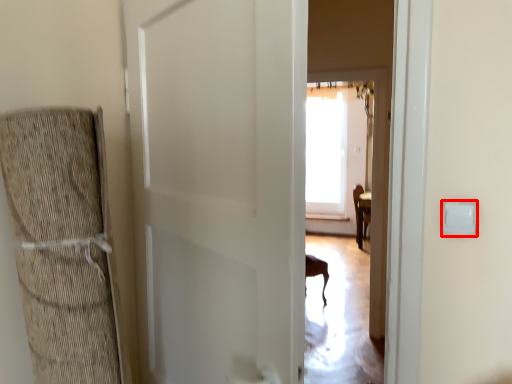
Question: From the image, what is the correct spatial relationship of light switch (annotated by the red box) in relation to door?

Choices:
 (A) left
 (B) right

Answer: (B)